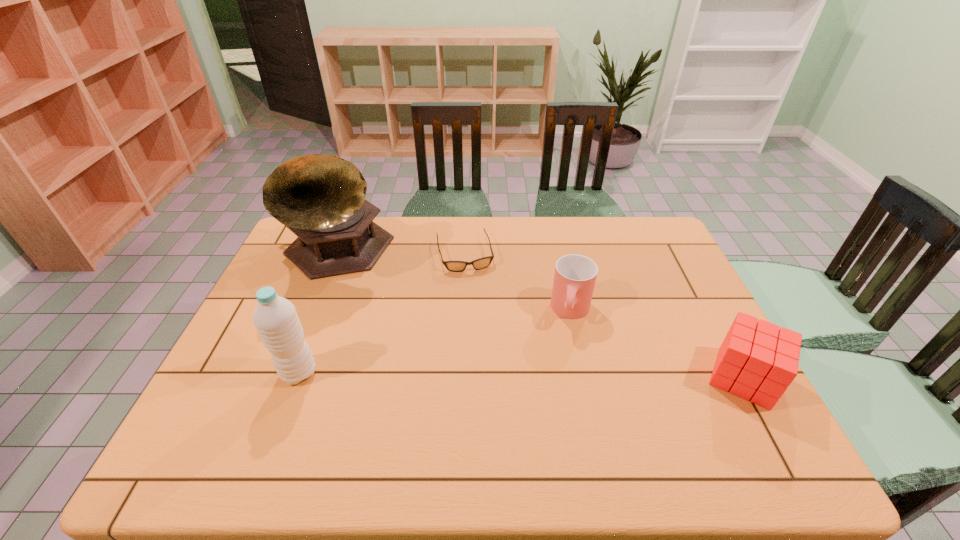
Where is `water bottle`? The width and height of the screenshot is (960, 540). water bottle is located at coordinates (275, 318).

Image resolution: width=960 pixels, height=540 pixels. I want to click on cube, so click(757, 361).

At what (x,y) coordinates should I click in order to perform the action: click on the shortest object. Please return your answer as a coordinate pair (x, y). Looking at the image, I should click on [x=455, y=266].

This screenshot has height=540, width=960. What are the coordinates of `sunglasses` in the screenshot? It's located at (455, 266).

Find the location of a particular element. cup is located at coordinates (575, 275).

I want to click on the tallest object, so 321,198.

Image resolution: width=960 pixels, height=540 pixels. Find the location of `vacant area situated 0.370m on the right of the second tallest object`. vacant area situated 0.370m on the right of the second tallest object is located at coordinates point(464,373).

Find the location of `blank space located on the back of the rightmost object`. blank space located on the back of the rightmost object is located at coordinates (680, 260).

The height and width of the screenshot is (540, 960). I want to click on vacant space located 0.320m on the front-facing side of the shortest object, so click(490, 351).

Identify the location of free space located 0.080m on the front-facing side of the shortest object. Image resolution: width=960 pixels, height=540 pixels. (473, 290).